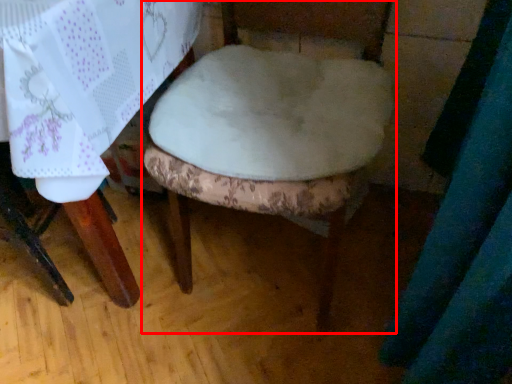
Question: From the image's perspective, where is chair (annotated by the red box) located relative to round table?

Choices:
 (A) below
 (B) above

Answer: (A)